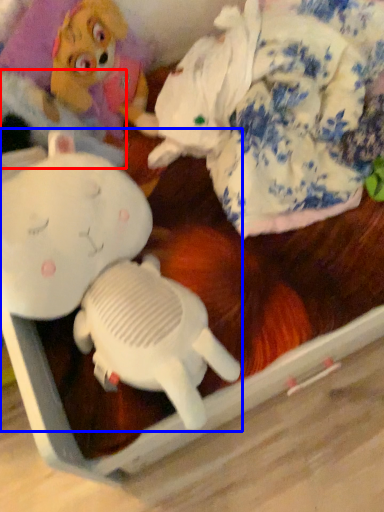
Question: Which object appears farthest to the camera in this image, clothing (highlighted by a red box) or toy (highlighted by a blue box)?

Choices:
 (A) clothing
 (B) toy

Answer: (A)